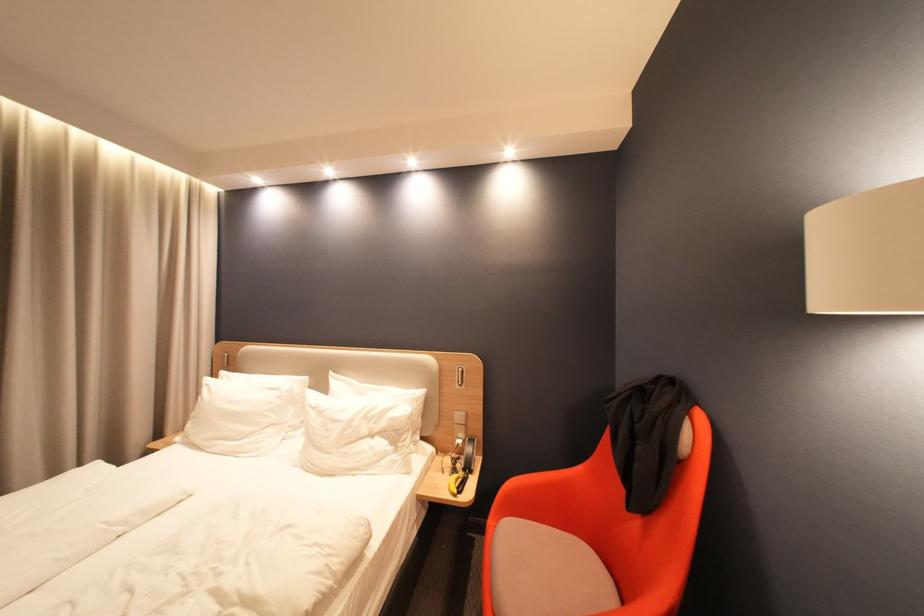
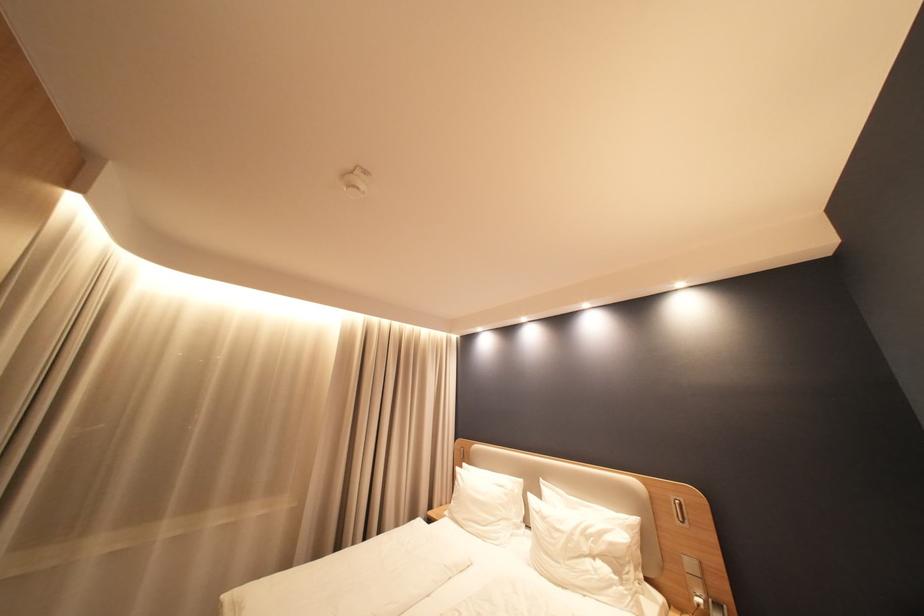
The point at (323, 407) is marked in the first image. Where is the corresponding point in the second image?

(546, 511)